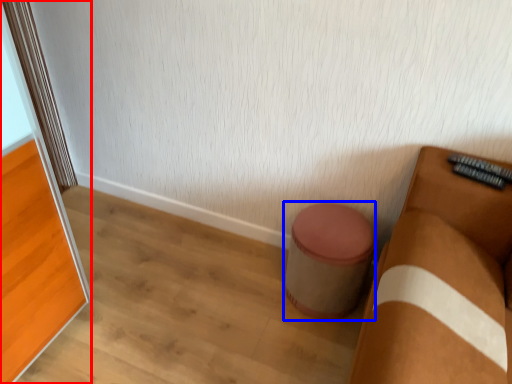
Question: Which object is further to the camera taking this photo, screen door (highlighted by a red box) or stool (highlighted by a blue box)?

Choices:
 (A) screen door
 (B) stool

Answer: (B)